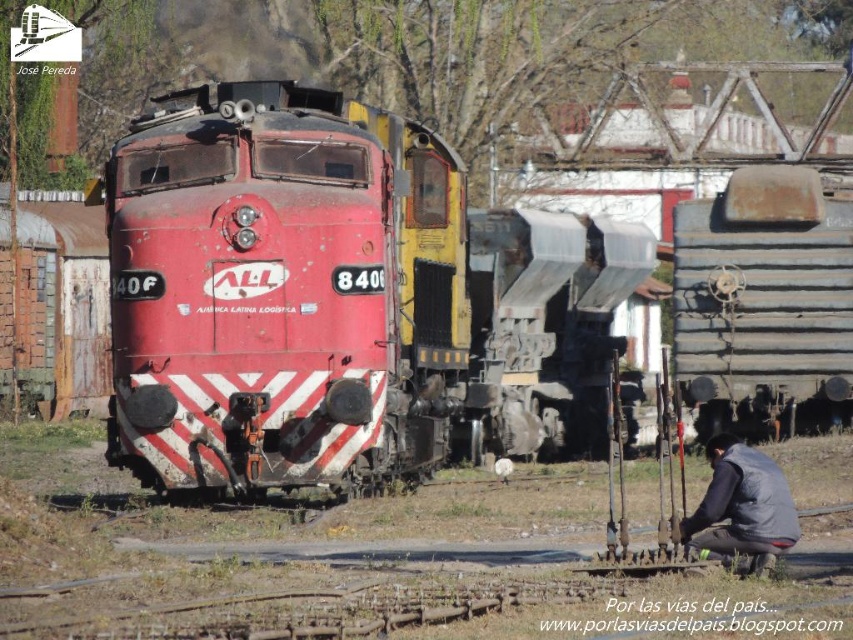
You are a railway inspector checking the alignment of the train cars. You notice the matte red locomotive at center and the rusty metal train car at right. Which one is positioned higher in the image?

A: The matte red locomotive at center is positioned higher than the rusty metal train car at right in the image.

You are standing at the point labeled as point (764, 305) in the image. Which object is directly in front of you?

The rusty metal train car at right is directly in front of you at point (764, 305).

You are standing at the entrance of the railway yard and want to locate the matte red locomotive at center. According to the coordinates provided, where should you look to find it?

The matte red locomotive at center is located at coordinates point [283,291].